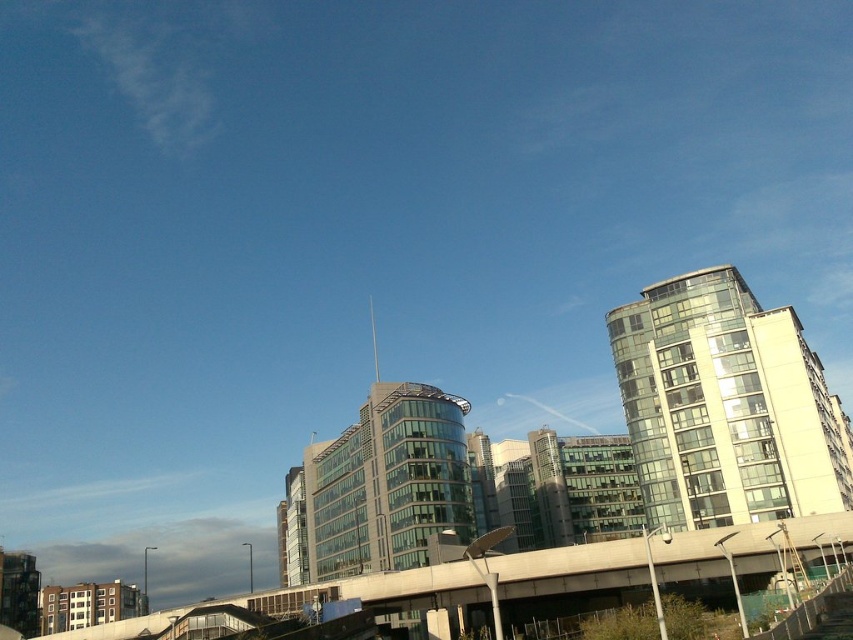
Is glassy white building at upper right positioned behind concrete overpass at lower center?

Yes, glassy white building at upper right is further from the viewer.

Who is shorter, glassy white building at upper right or concrete overpass at lower center?

concrete overpass at lower center is shorter.

Who is more distant from viewer, [660,481] or [103,627]?

The point [660,481] is behind.

This screenshot has height=640, width=853. What are the coordinates of `glassy white building at upper right` in the screenshot? It's located at (724, 404).